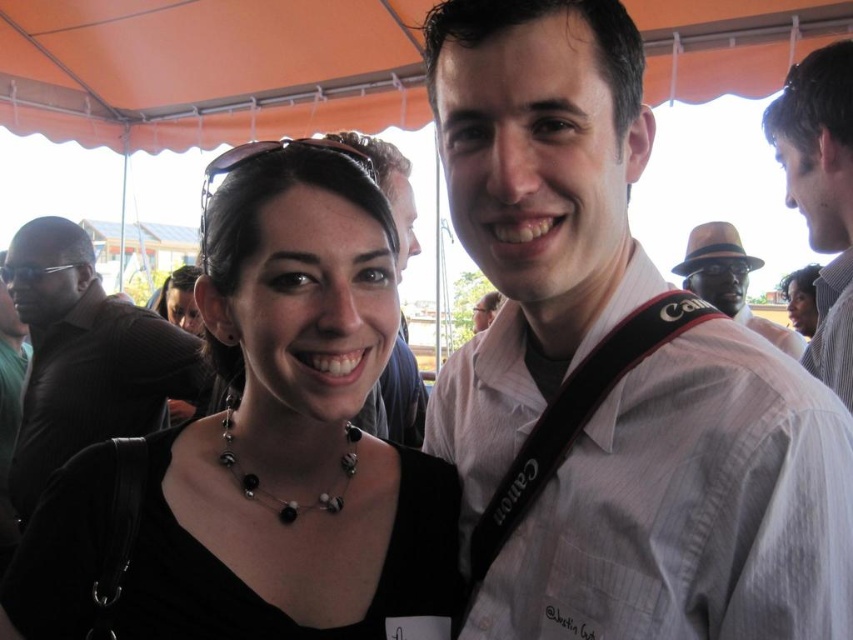
Question: Which point is closer to the camera taking this photo?

Choices:
 (A) (813, 625)
 (B) (698, 269)
 (C) (848, 365)

Answer: (A)

Question: Can you confirm if white striped shirt at center is positioned above matte black shirt at center?

Choices:
 (A) yes
 (B) no

Answer: (B)

Question: Considering the real-world distances, which object is farthest from the white striped shirt at upper right?

Choices:
 (A) black leather shirt at center
 (B) brown felt fedora at upper right

Answer: (A)

Question: Can you confirm if black matte necklace at center is positioned to the left of matte black shirt at center?

Choices:
 (A) yes
 (B) no

Answer: (A)

Question: Which object is the closest to the matte black shirt at center?

Choices:
 (A) white striped shirt at center
 (B) brown felt fedora at upper right
 (C) white striped shirt at upper right
 (D) black beaded necklace at center

Answer: (A)

Question: Is black matte necklace at center to the left of white striped shirt at upper right from the viewer's perspective?

Choices:
 (A) yes
 (B) no

Answer: (A)